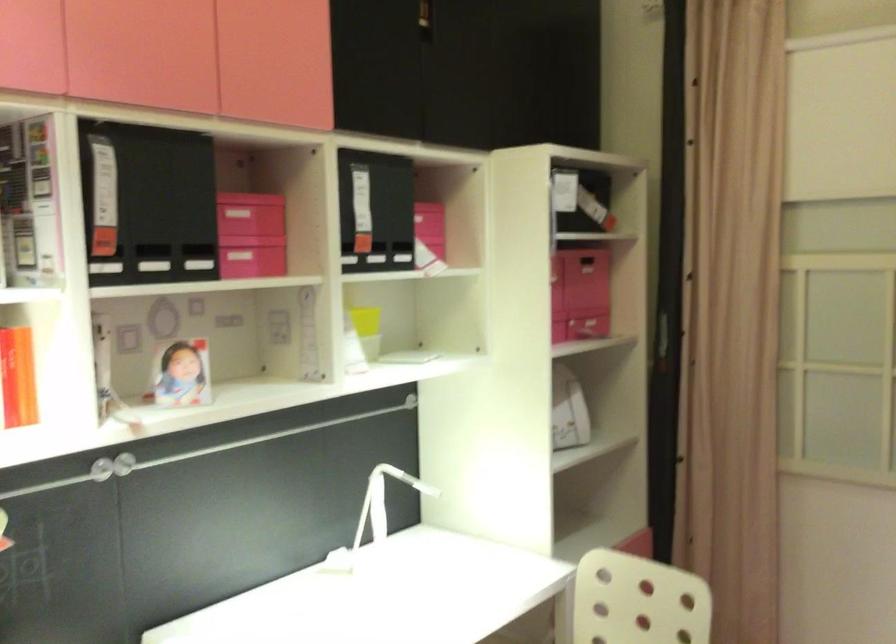
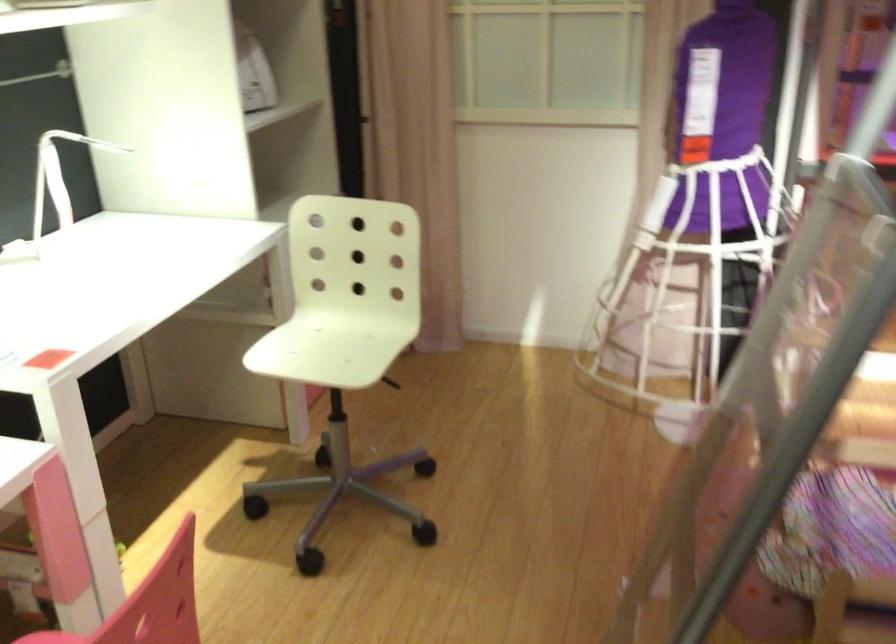
The point at (x=371, y=507) is marked in the first image. Where is the corresponding point in the second image?

(58, 176)